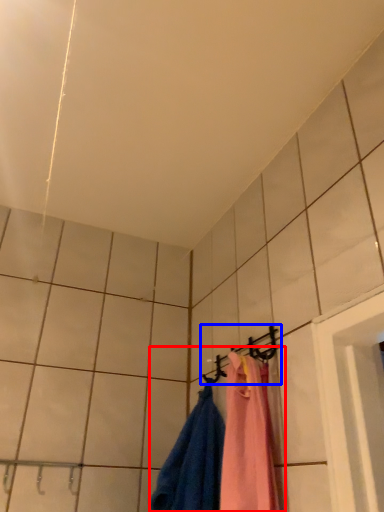
Question: Which object is closer to the camera taking this photo, laundry (highlighted by a red box) or hanger (highlighted by a blue box)?

Choices:
 (A) laundry
 (B) hanger

Answer: (A)